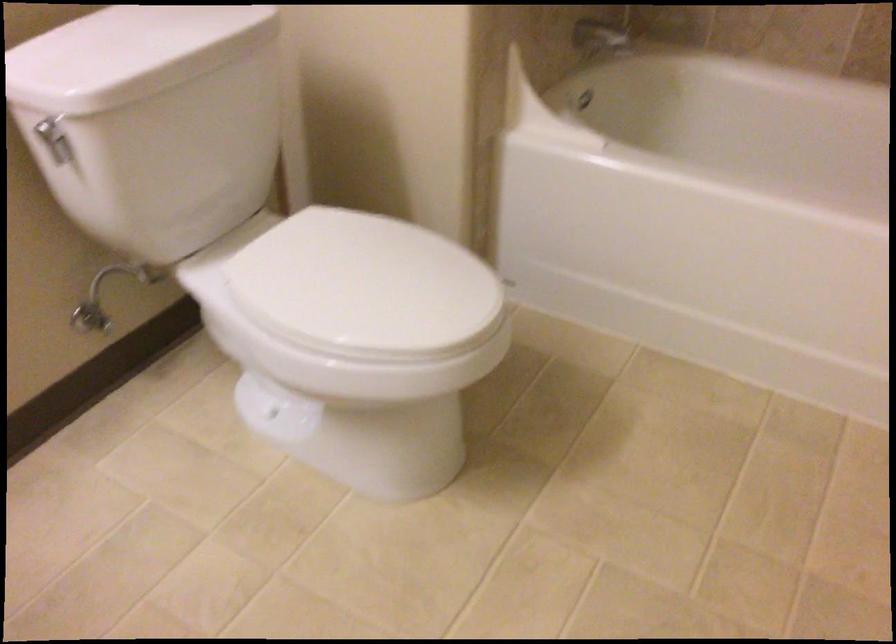
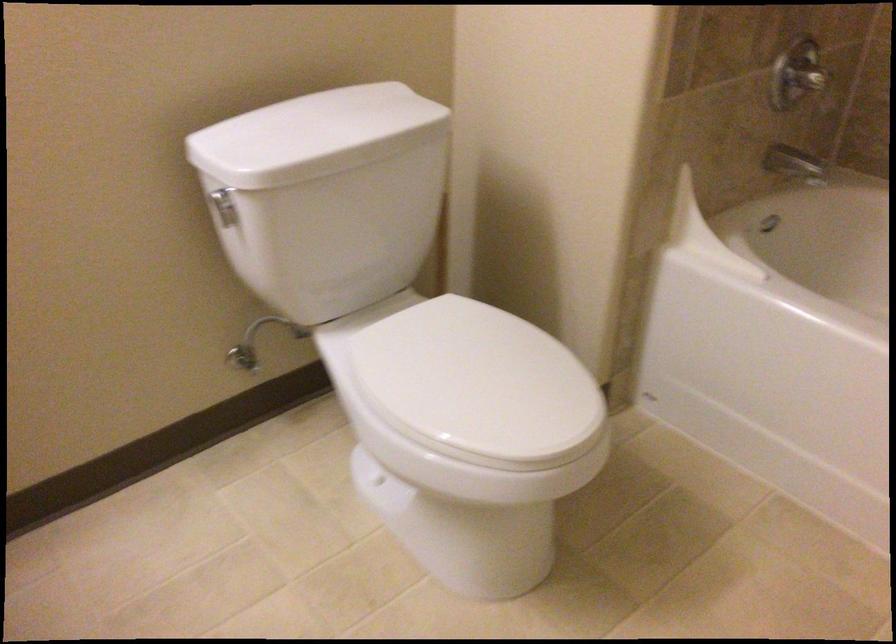
Where in the second image is the point corresponding to (x=88, y=317) from the first image?

(243, 357)